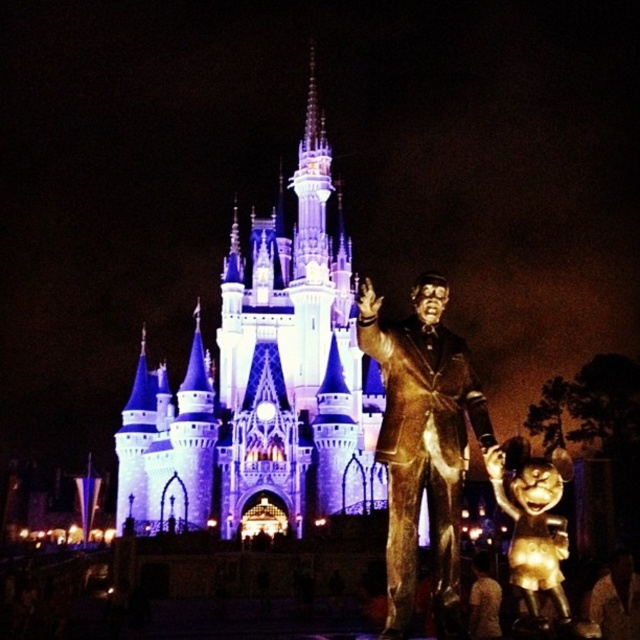
You are standing at the entrance of the theme park and want to locate the bronze statue at center. According to the coordinates provided, where should you look to find it?

The bronze statue at center is located at coordinates point (422, 444).

You are a guest at the theme park and want to take a photo of both the illuminated stone castle at center and the gold metallic minnie mouse at lower right. Which one should you focus on first to ensure both are in the frame?

Since the illuminated stone castle at center is located above the gold metallic minnie mouse at lower right, you should focus on the illuminated stone castle at center first to ensure both are in the frame.